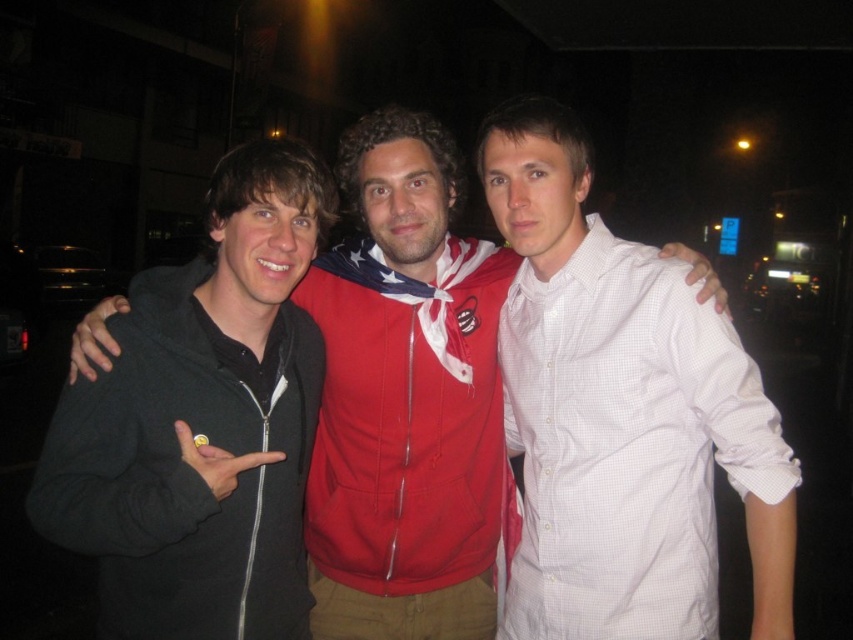
Which is more to the left, white checkered shirt at center or black zip-up hoodie at left?

black zip-up hoodie at left

Can you confirm if white checkered shirt at center is smaller than black zip-up hoodie at left?

No, white checkered shirt at center is not smaller than black zip-up hoodie at left.

Between point (612, 337) and point (146, 618), which one is positioned in front?

Point (146, 618)

What are the coordinates of `white checkered shirt at center` in the screenshot? It's located at (621, 413).

Measure the distance between black zip-up hoodie at left and camera.

They are 4.78 feet apart.

In the scene shown: Is black zip-up hoodie at left below red hoodie at center?

Yes, black zip-up hoodie at left is below red hoodie at center.

Identify the location of black zip-up hoodie at left. This screenshot has height=640, width=853. (202, 422).

Is the position of white checkered shirt at center less distant than that of red hoodie at center?

That is True.

Between point (625, 563) and point (82, 369), which one is positioned behind?

Point (625, 563)

Image resolution: width=853 pixels, height=640 pixels. Find the location of `white checkered shirt at center`. white checkered shirt at center is located at coordinates (621, 413).

At what (x,y) coordinates should I click in order to perform the action: click on white checkered shirt at center. Please return your answer as a coordinate pair (x, y). This screenshot has width=853, height=640. Looking at the image, I should click on (621, 413).